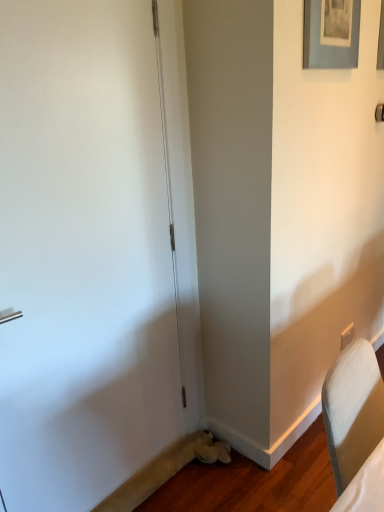
Image resolution: width=384 pixels, height=512 pixels. What do you see at coordinates (347, 336) in the screenshot?
I see `beige plastic electric outlet at lower right` at bounding box center [347, 336].

Locate an element on the screen. This screenshot has width=384, height=512. white matte door at left is located at coordinates (83, 254).

How different are the orientations of beige plastic electric outlet at lower right and matte gray picture frame at upper right in degrees?

1.55 degrees.

You are a GUI agent. You are given a task and a screenshot of the screen. Output one action in this format:
    pyautogui.click(x=<x>, y=<y>)
    Task: Click on the picture frame above the beige plastic electric outlet at lower right (from the image's perspective)
    
    Given the screenshot: What is the action you would take?
    pyautogui.click(x=331, y=33)

Looking at their sizes, would you say beige plastic electric outlet at lower right is wider or thinner than matte gray picture frame at upper right?

Clearly, beige plastic electric outlet at lower right has less width compared to matte gray picture frame at upper right.

Does beige plastic electric outlet at lower right have a smaller size compared to white matte door at left?

Correct, beige plastic electric outlet at lower right occupies less space than white matte door at left.

Is beige plastic electric outlet at lower right not near white matte door at left?

Indeed, beige plastic electric outlet at lower right is not near white matte door at left.

What's the angular difference between beige plastic electric outlet at lower right and white matte door at left's facing directions?

The angle between the facing direction of beige plastic electric outlet at lower right and the facing direction of white matte door at left is 0.719 degrees.

Where is `door to the left of beige plastic electric outlet at lower right`? door to the left of beige plastic electric outlet at lower right is located at coordinates (83, 254).

Is white matte door at left situated inside matte gray picture frame at upper right or outside?

white matte door at left is spatially situated outside matte gray picture frame at upper right.

Is white matte door at left shorter than matte gray picture frame at upper right?

In fact, white matte door at left may be taller than matte gray picture frame at upper right.

Is white matte door at left bigger than matte gray picture frame at upper right?

Yes.

Is white matte door at left facing towards matte gray picture frame at upper right?

No.

From the picture: Is matte gray picture frame at upper right further to camera compared to white matte door at left?

Yes.

Based on the photo, between matte gray picture frame at upper right and white matte door at left, which one has smaller width?

matte gray picture frame at upper right.

Looking at this image, from the image's perspective, is matte gray picture frame at upper right located above or below white matte door at left?

Based on their image positions, matte gray picture frame at upper right is located above white matte door at left.

Is matte gray picture frame at upper right looking in the opposite direction of beige plastic electric outlet at lower right?

No, beige plastic electric outlet at lower right is not at the back of matte gray picture frame at upper right.

Can you tell me how much matte gray picture frame at upper right and beige plastic electric outlet at lower right differ in facing direction?

1.55 degrees.

Find the location of `picture frame positioned vertically above the beige plastic electric outlet at lower right (from a real-world perspective)`. picture frame positioned vertically above the beige plastic electric outlet at lower right (from a real-world perspective) is located at coordinates (331, 33).

Between matte gray picture frame at upper right and beige plastic electric outlet at lower right, which one is positioned behind?

beige plastic electric outlet at lower right is more distant.

Is white matte door at left at the right side of beige plastic electric outlet at lower right?

In fact, white matte door at left is to the left of beige plastic electric outlet at lower right.

Who is smaller, white matte door at left or beige plastic electric outlet at lower right?

With smaller size is beige plastic electric outlet at lower right.

Can you confirm if white matte door at left is wider than beige plastic electric outlet at lower right?

Yes.

What's the angular difference between white matte door at left and beige plastic electric outlet at lower right's facing directions?

0.719 degrees separate the facing orientations of white matte door at left and beige plastic electric outlet at lower right.

Find the location of `picture frame on the left of beige plastic electric outlet at lower right`. picture frame on the left of beige plastic electric outlet at lower right is located at coordinates (331, 33).

You are a GUI agent. You are given a task and a screenshot of the screen. Output one action in this format:
    pyautogui.click(x=<x>, y=<y>)
    Task: Click on the electric outlet below the white matte door at left (from a real-world perspective)
    Image resolution: width=384 pixels, height=512 pixels.
    Given the screenshot: What is the action you would take?
    pyautogui.click(x=347, y=336)

Based on their spatial positions, is beige plastic electric outlet at lower right or white matte door at left closer to matte gray picture frame at upper right?

Among the two, white matte door at left is located nearer to matte gray picture frame at upper right.

Which object lies further to the anchor point white matte door at left, beige plastic electric outlet at lower right or matte gray picture frame at upper right?

Among the two, beige plastic electric outlet at lower right is located further to white matte door at left.

Looking at the image, which one is located further to beige plastic electric outlet at lower right, white matte door at left or matte gray picture frame at upper right?

The object further to beige plastic electric outlet at lower right is white matte door at left.

Which object lies further to the anchor point white matte door at left, matte gray picture frame at upper right or beige plastic electric outlet at lower right?

beige plastic electric outlet at lower right lies further to white matte door at left than the other object.

Estimate the real-world distances between objects in this image. Which object is closer to matte gray picture frame at upper right, white matte door at left or beige plastic electric outlet at lower right?

Based on the image, white matte door at left appears to be nearer to matte gray picture frame at upper right.

Considering their positions, is matte gray picture frame at upper right positioned further to beige plastic electric outlet at lower right than white matte door at left?

Based on the image, white matte door at left appears to be further to beige plastic electric outlet at lower right.

Identify the location of picture frame between white matte door at left and beige plastic electric outlet at lower right along the z-axis. The height and width of the screenshot is (512, 384). (331, 33).